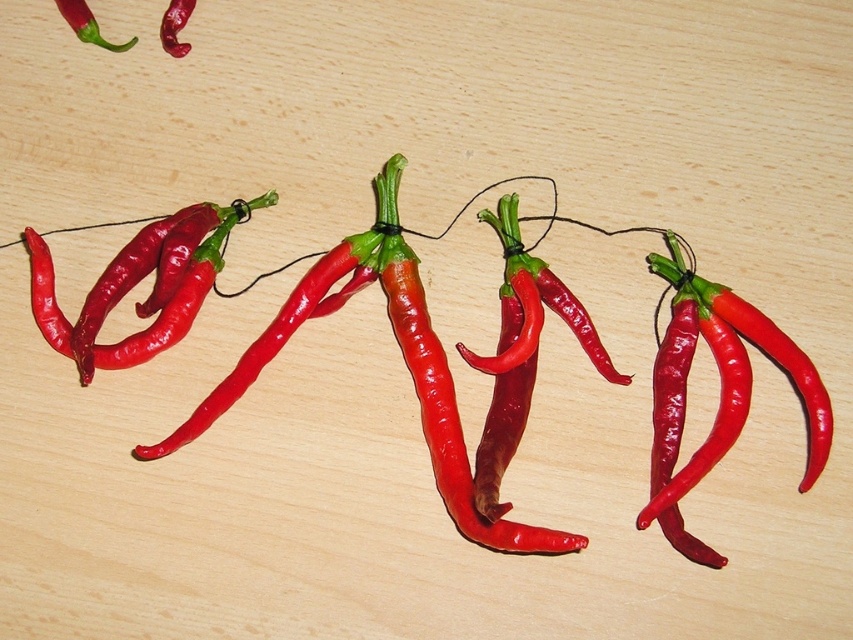
Based on the photo, you are a chef preparing to hang a decorative chili pepper arrangement. The point where you want to hang it is at point [64,19]. If the arrangement requires 4.62 feet of space between the hanging point and the edge of the peppers, will there be enough space?

The distance between the point [64,19] and the edge of the peppers is 4.62 feet, so there is enough space for the arrangement.

You are a chef preparing to photograph a dish and need to place a garnish near the point marked at coordinates (86, 24). What object is located at that point?

The point at coordinates (86, 24) indicates the location of the matte red pepper at upper left.

You are a chef preparing to photograph a dish and need to adjust the peppers for better lighting. If you want to move the matte red pepper at upper left so that it no longer blocks the glossy red pepper at upper left, which direction should you move it?

The matte red pepper at upper left is currently in front of the glossy red pepper at upper left. To stop blocking it, move the matte red pepper at upper left backward away from the camera.